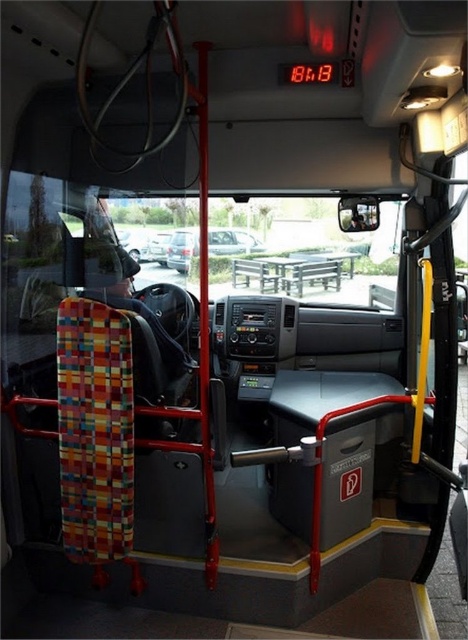
Question: Does metallic silver car at center appear under silver metallic sedan at center?

Choices:
 (A) no
 (B) yes

Answer: (B)

Question: Can you confirm if metallic silver car at center is smaller than silver metallic sedan at center?

Choices:
 (A) no
 (B) yes

Answer: (A)

Question: Among these objects, which one is farthest from the camera?

Choices:
 (A) silver metallic sedan at center
 (B) metallic silver car at center

Answer: (A)

Question: From the image, what is the correct spatial relationship of metallic silver car at center in relation to silver metallic sedan at center?

Choices:
 (A) below
 (B) above

Answer: (A)